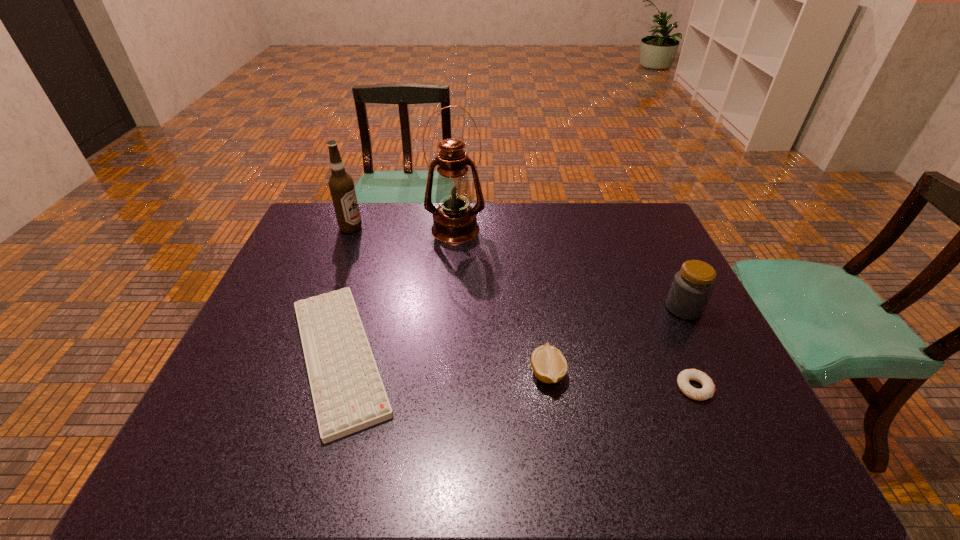
Locate an element on the screen. Image resolution: width=960 pixels, height=540 pixels. vacant space positioned 0.230m on the surface of the jar near the warning symbol is located at coordinates (581, 308).

In order to click on free location located on the surface of the jar near the warning symbol in this screenshot , I will do `click(556, 308)`.

The image size is (960, 540). I want to click on blank area located on the surface of the jar near the warning symbol, so click(x=518, y=308).

Identify the location of free region located on the left of the third object from right to left. This screenshot has height=540, width=960. (432, 374).

Locate an element on the screen. This screenshot has height=540, width=960. vacant region located on the back of the computer keyboard is located at coordinates (378, 226).

Where is `vacant space located on the back of the doughnut`? This screenshot has width=960, height=540. vacant space located on the back of the doughnut is located at coordinates (644, 272).

Find the location of a particular element. The image size is (960, 540). oil lamp located at the far edge is located at coordinates (454, 221).

Where is `alcohol that is at the far edge`? alcohol that is at the far edge is located at coordinates (341, 185).

I want to click on object located at the near edge, so click(x=348, y=393).

You are a GUI agent. You are given a task and a screenshot of the screen. Output one action in this format:
    pyautogui.click(x=<x>, y=<y>)
    Task: Click on the alcohol located in the left edge section of the desktop
    The height and width of the screenshot is (540, 960).
    Given the screenshot: What is the action you would take?
    pyautogui.click(x=341, y=185)